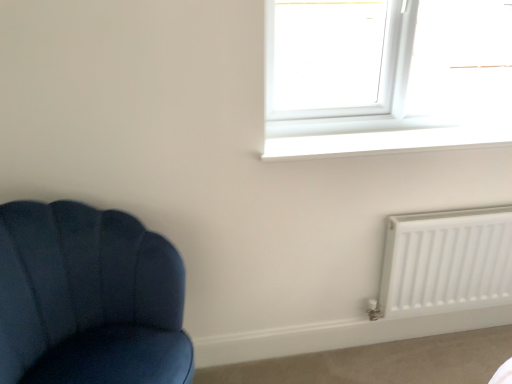
Question: Is white plastic window at upper right shorter than velvet blue chair at left?

Choices:
 (A) no
 (B) yes

Answer: (B)

Question: From the image's perspective, is white plastic window at upper right on top of velvet blue chair at left?

Choices:
 (A) yes
 (B) no

Answer: (A)

Question: From a real-world perspective, is white plastic window at upper right on velvet blue chair at left?

Choices:
 (A) yes
 (B) no

Answer: (A)

Question: Does white plastic window at upper right appear on the left side of velvet blue chair at left?

Choices:
 (A) no
 (B) yes

Answer: (A)

Question: Does white plastic window at upper right lie in front of velvet blue chair at left?

Choices:
 (A) yes
 (B) no

Answer: (B)

Question: Do you think velvet blue chair at left is within white plastic window at upper right, or outside of it?

Choices:
 (A) inside
 (B) outside

Answer: (B)

Question: From a real-world perspective, is velvet blue chair at left positioned above or below white plastic window at upper right?

Choices:
 (A) below
 (B) above

Answer: (A)

Question: Looking at their shapes, would you say velvet blue chair at left is wider or thinner than white plastic window at upper right?

Choices:
 (A) wide
 (B) thin

Answer: (A)

Question: In terms of size, does velvet blue chair at left appear bigger or smaller than white plastic window at upper right?

Choices:
 (A) small
 (B) big

Answer: (B)

Question: From a real-world perspective, is white matte radiator at lower right physically located above or below white plastic window at upper right?

Choices:
 (A) above
 (B) below

Answer: (B)

Question: From their relative heights in the image, would you say white matte radiator at lower right is taller or shorter than white plastic window at upper right?

Choices:
 (A) short
 (B) tall

Answer: (A)

Question: Is point (406, 311) positioned closer to the camera than point (292, 46)?

Choices:
 (A) closer
 (B) farther

Answer: (B)

Question: Looking at their shapes, would you say white matte radiator at lower right is wider or thinner than white plastic window at upper right?

Choices:
 (A) wide
 (B) thin

Answer: (B)

Question: In the image, is white plastic window at upper right positioned in front of or behind white smooth window sill at upper center?

Choices:
 (A) behind
 (B) front

Answer: (A)

Question: From a real-world perspective, relative to white smooth window sill at upper center, is white plastic window at upper right vertically above or below?

Choices:
 (A) above
 (B) below

Answer: (A)